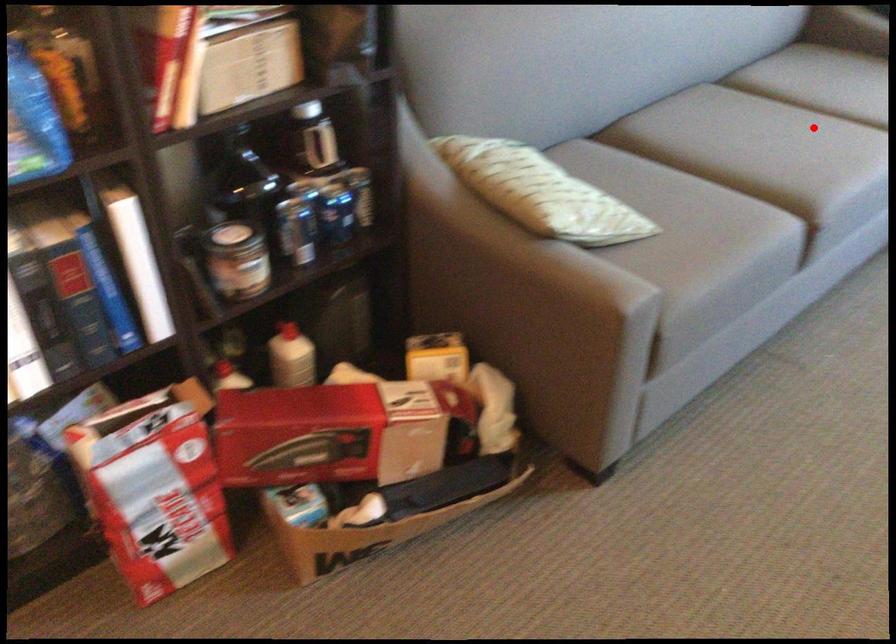
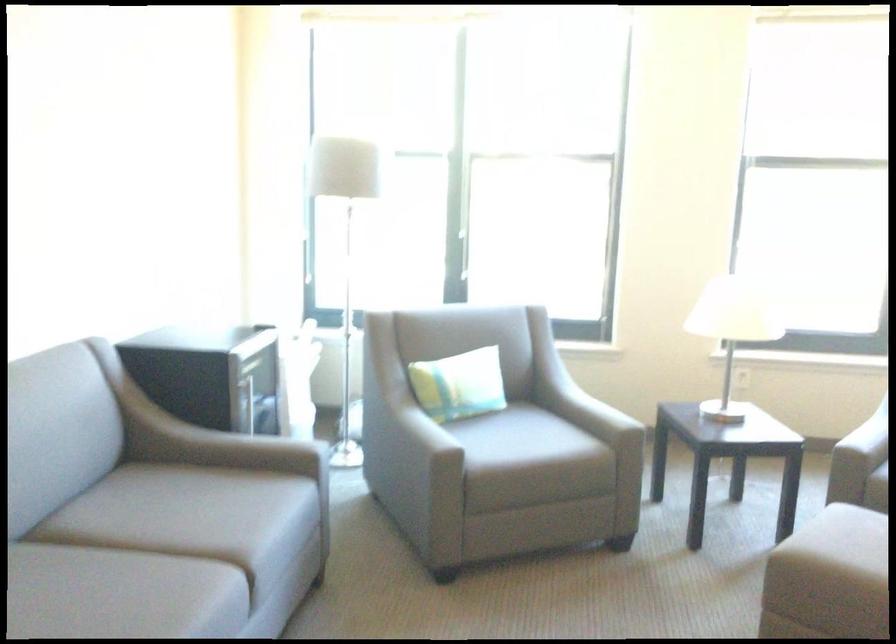
Question: I am providing you with two images of the same scene from different viewpoints. In image1, a red point is highlighted. Considering the same 3D point in image2, which of the following is correct?

Choices:
 (A) It is closer
 (B) It is farther

Answer: (A)